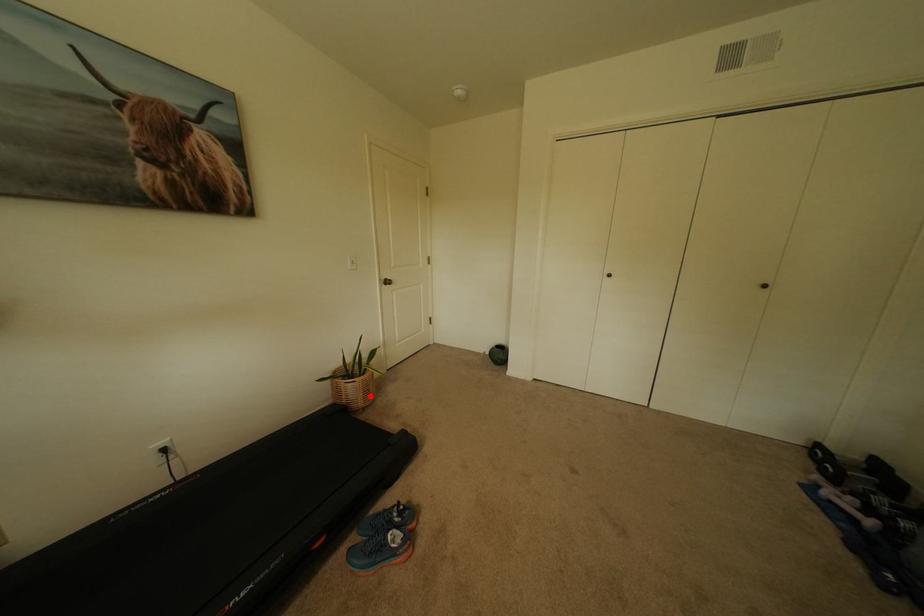
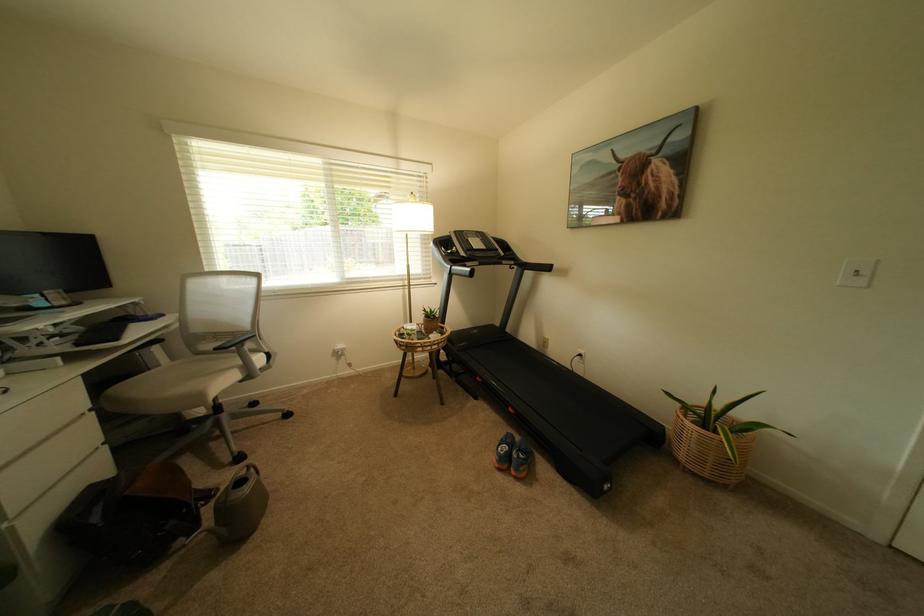
Question: I am providing you with two images of the same scene from different viewpoints. Given a red point in image1, look at the same physical point in image2. Is it:

Choices:
 (A) Closer to the viewpoint
 (B) Farther from the viewpoint

Answer: (B)